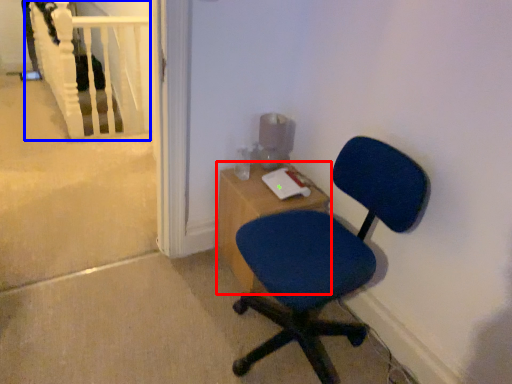
Question: Which object is closer to the camera taking this photo, desk (highlighted by a red box) or rail (highlighted by a blue box)?

Choices:
 (A) desk
 (B) rail

Answer: (A)